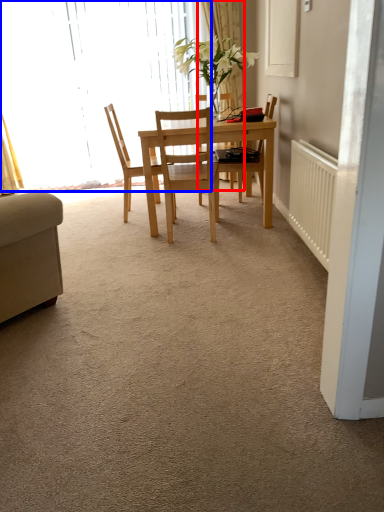
Question: Among these objects, which one is farthest to the camera, curtain (highlighted by a red box) or window (highlighted by a blue box)?

Choices:
 (A) curtain
 (B) window

Answer: (B)